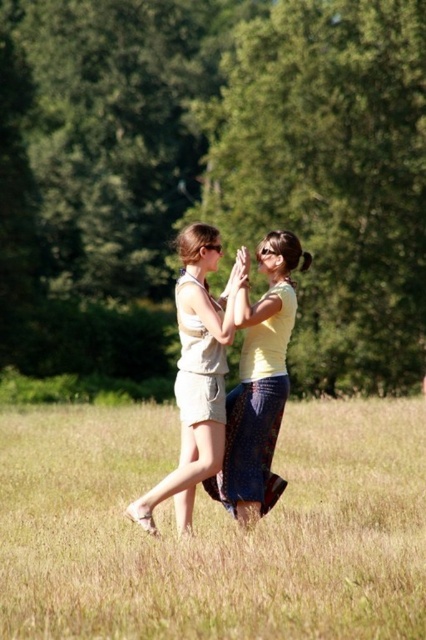
Consider the image. You are a photographer trying to capture a photo of the yellow matte skirt at center and the green leafy tree at center. You want to ensure the tree appears above the skirt in the photo. Based on the scene, will the tree naturally frame the skirt from above in your shot?

The green leafy tree at center is positioned over the yellow matte skirt at center, so yes, the tree will naturally frame the skirt from above in the photo.

You are a photographer trying to capture a closeup of the person on the right. You are currently at the position of point (x=8, y=157). To get a better shot, you need to move towards point (x=187, y=296). Will moving towards this point bring you closer to the person on the right?

Yes, moving towards point 0.463, 0441 will bring you closer to the person on the right because point (x=8, y=157) is further away from the camera than point (x=187, y=296).